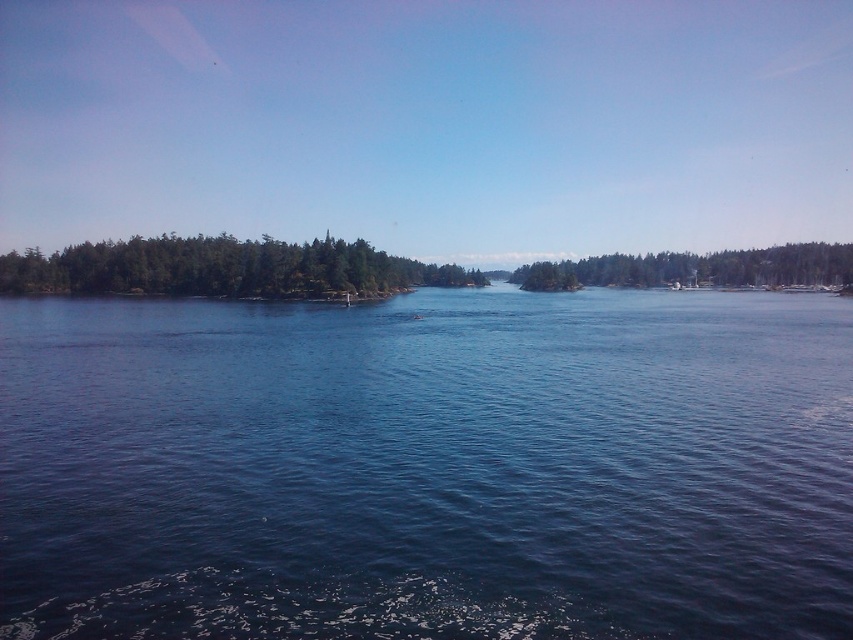
You are an observer on a boat looking at the scene. You notice the blue liquid water at center and the green matte trees at left. Which object appears narrower in the image?

The blue liquid water at center appears narrower than the green matte trees at left.

You are navigating a small boat through the waterway scene. You see a point marked at coordinates (x=222, y=268). What object is located at this point?

The point at coordinates (x=222, y=268) marks green matte trees at left.